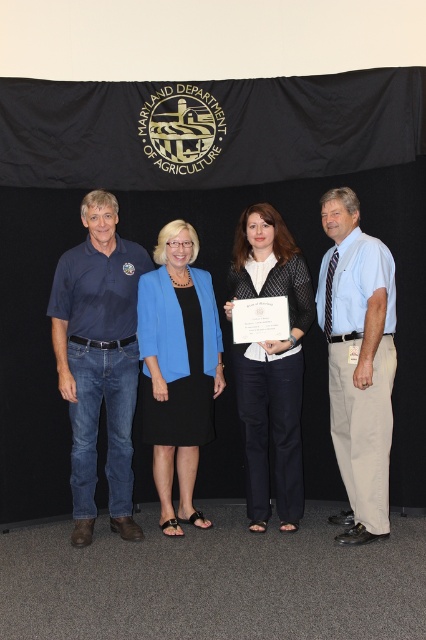
You are organizing a group photo and need to arrange the matte blue shirt at left and the light blue shirt at center based on their sizes. Which shirt should be placed on the side to accommodate its larger size?

The matte blue shirt at left should be placed on the side because its width is larger than the light blue shirt at center, allowing more space for it in the arrangement.

In the scene shown: You are an event organizer at the Maryland Department of Agriculture. You need to determine the correct order of clothing layers for the individuals in the photo. Which clothing item is on top of the other between the light blue shirt at center and the blue fabric jacket at center?

The light blue shirt at center is positioned over the blue fabric jacket at center, so the light blue shirt is on top.

You are at a formal event and need to identify clothing items. Which clothing item is positioned higher on the person wearing both the light blue shirt at center and the black textured sweater at center?

The light blue shirt at center is located above the black textured sweater at center, so the light blue shirt at center is positioned higher.